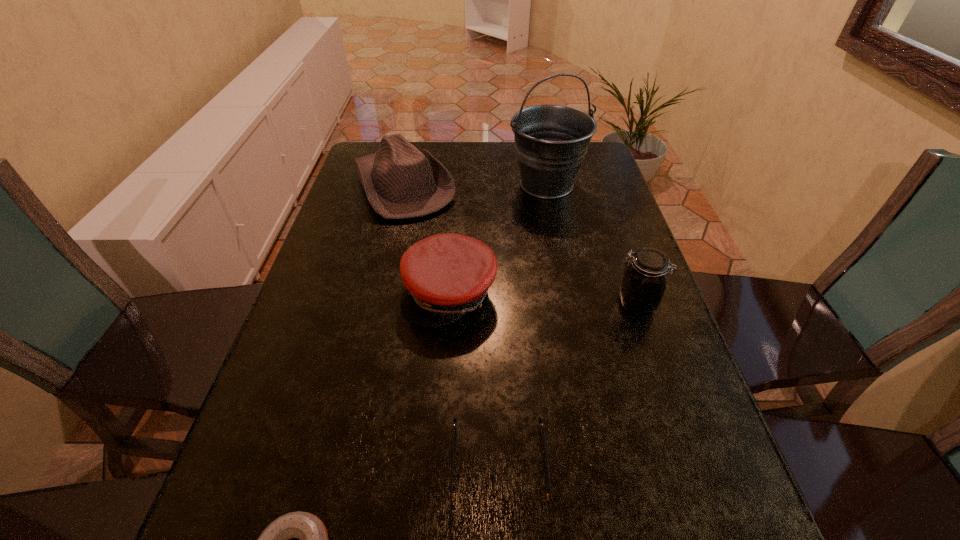
The width and height of the screenshot is (960, 540). In the image, there is a desktop. Identify the location of vacant space at the left edge. (337, 229).

Where is `vacant space at the right edge of the desktop`? This screenshot has width=960, height=540. vacant space at the right edge of the desktop is located at coordinates (605, 200).

Image resolution: width=960 pixels, height=540 pixels. In the image, there is a desktop. Identify the location of free space at the far left corner. (372, 141).

The width and height of the screenshot is (960, 540). What are the coordinates of `free space between the tallest object and the jar` in the screenshot? It's located at (591, 244).

Locate an element on the screen. empty space that is in between the jar and the spectacles is located at coordinates click(x=567, y=384).

You are a GUI agent. You are given a task and a screenshot of the screen. Output one action in this format:
    pyautogui.click(x=<x>, y=<y>)
    Task: Click on the free space between the fourth tallest object and the bucket
    
    Given the screenshot: What is the action you would take?
    pyautogui.click(x=498, y=239)

Locate an element on the screen. free area in between the second nearest object and the fedora is located at coordinates (451, 325).

The height and width of the screenshot is (540, 960). In order to click on vacant region between the fedora and the bucket in this screenshot , I will do click(x=475, y=185).

Image resolution: width=960 pixels, height=540 pixels. Find the location of `vacant space that is in between the jar and the bucket`. vacant space that is in between the jar and the bucket is located at coordinates (591, 244).

Where is `vacant area that lies between the jar and the fedora`? The width and height of the screenshot is (960, 540). vacant area that lies between the jar and the fedora is located at coordinates (520, 244).